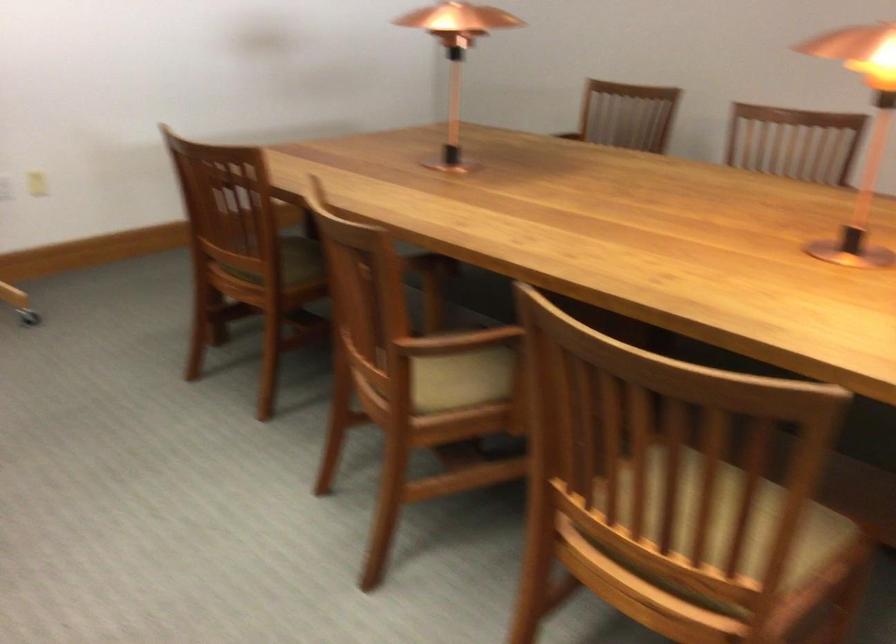
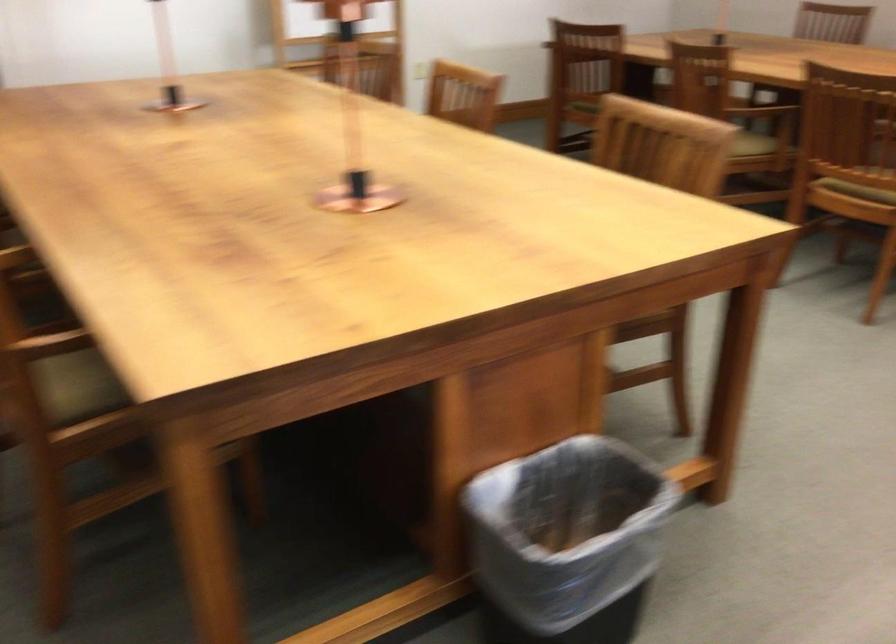
Question: I am providing you with two images of the same scene from different viewpoints. Which of the following objects are not visible in image2?

Choices:
 (A) green chair sitting surface
 (B) black trash can
 (C) beige chair sitting surface
 (D) gold-colored object

Answer: (C)